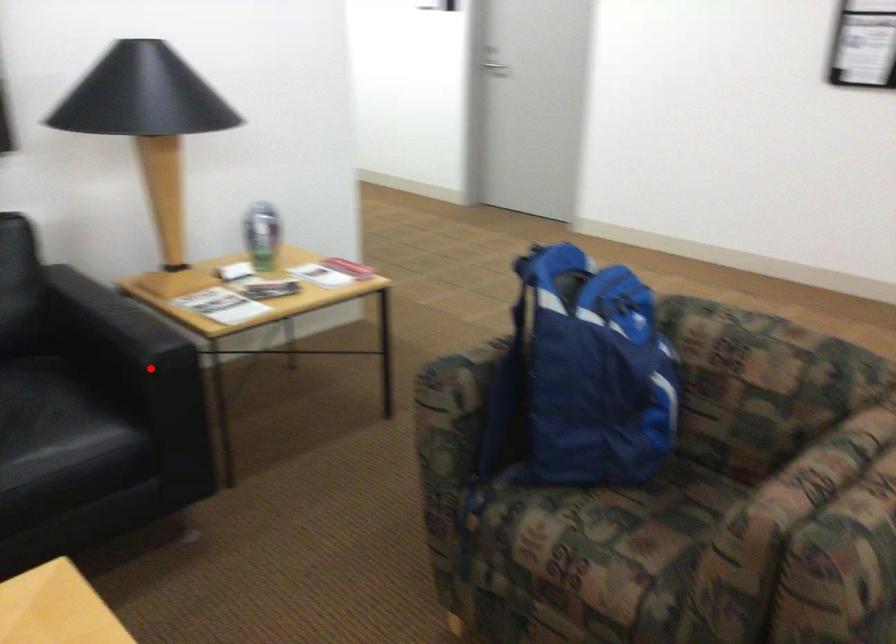
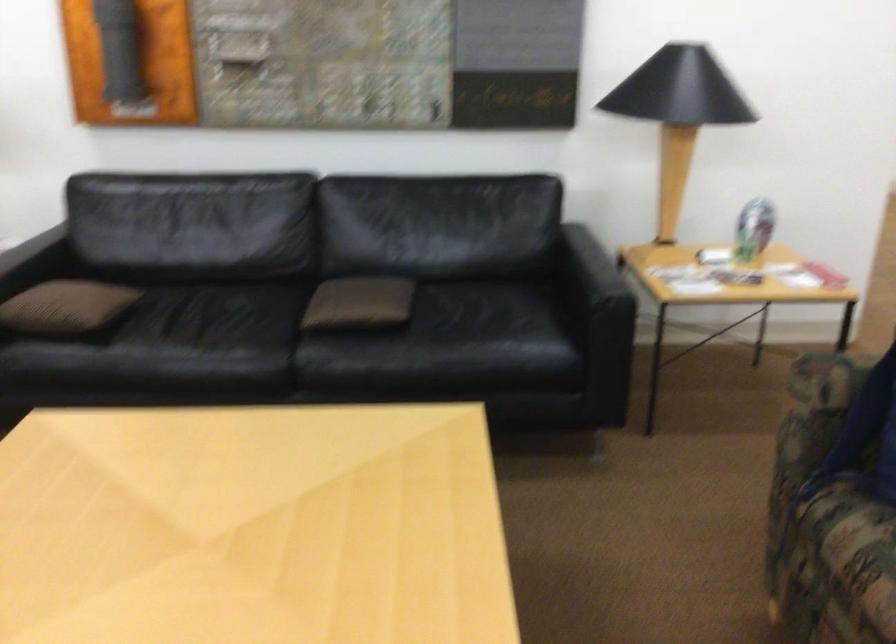
Question: A red point is marked in image1. In image2, is the corresponding 3D point closer to the camera or farther? Reply with the corresponding letter.

Choices:
 (A) The corresponding 3D point is closer.
 (B) The corresponding 3D point is farther.

Answer: (B)